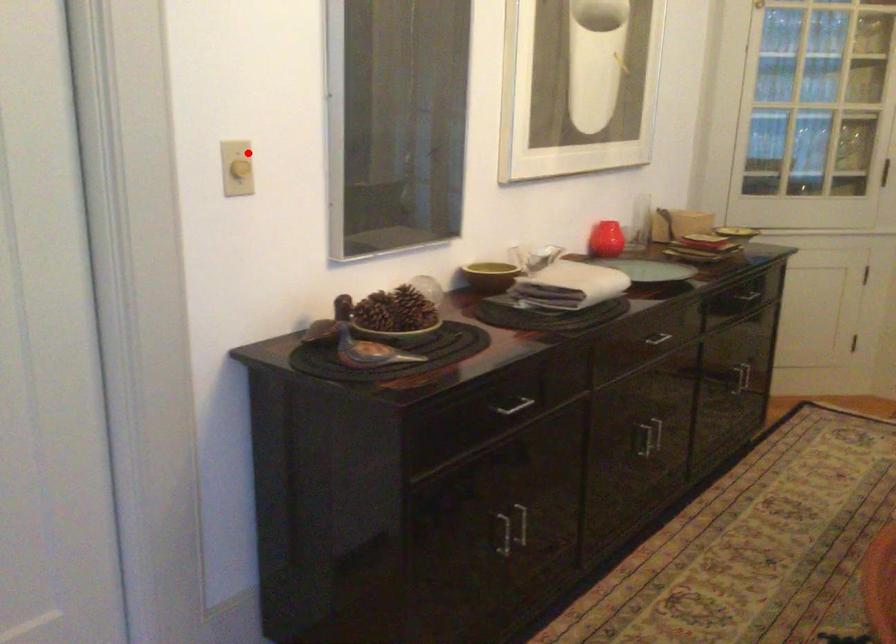
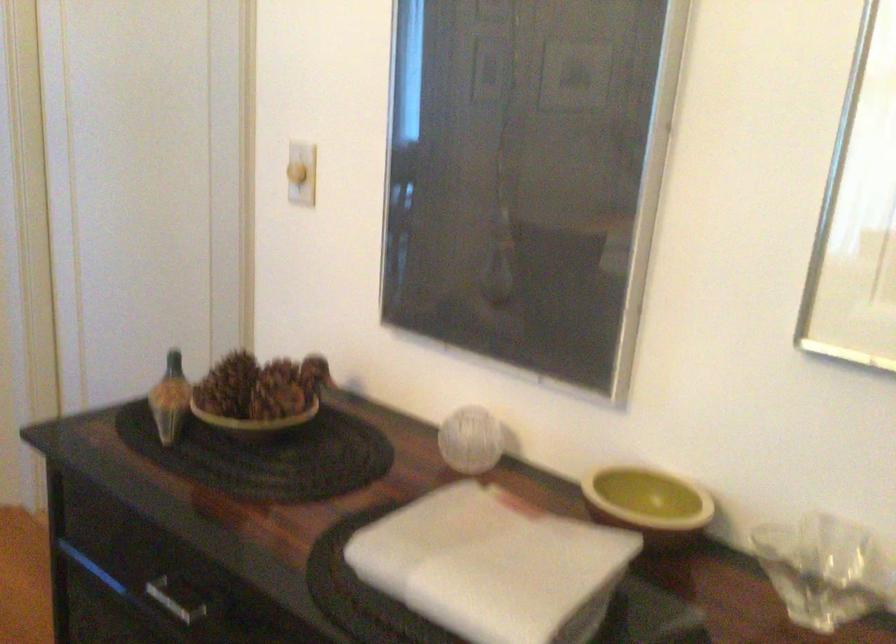
In the second image, find the point that corresponds to the highlighted location in the first image.

(297, 173)